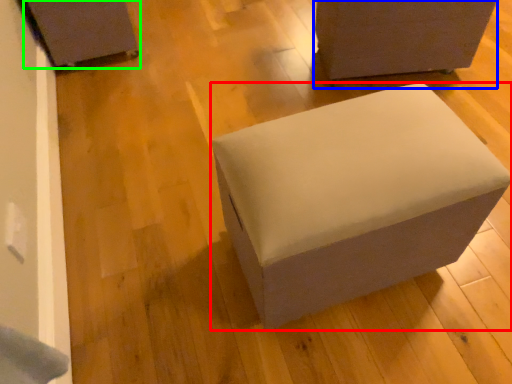
Question: Estimate the real-world distances between objects in this image. Which object is closer to furniture (highlighted by a red box), furniture (highlighted by a blue box) or furniture (highlighted by a green box)?

Choices:
 (A) furniture
 (B) furniture

Answer: (A)